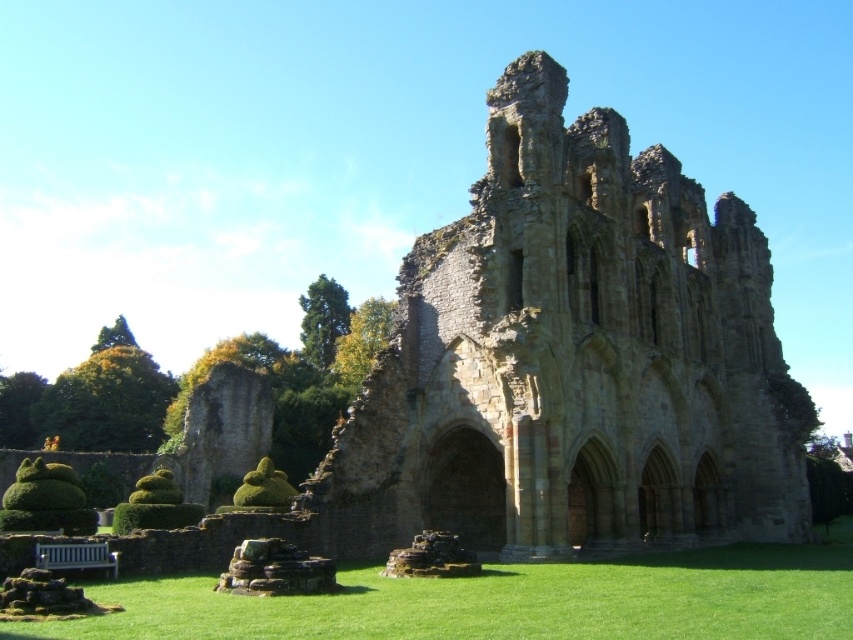
Consider the image. You are standing at the entrance of the historic stone structure and want to walk towards the point that is closer to you. Which point should you head towards, point [54,401] or point [25,483]?

You should head towards point [25,483] because it is closer to you than point [54,401], which is further away.

You are planning to set up a picnic blanket in the grassy area near the brown stone ruins at center. Considering the space available, will the green grass at lower center provide enough room for a picnic blanket that is 2 meters wide?

The brown stone ruins at center has a lesser width compared to green grass at lower center, so the green grass at lower center is wider. Since the picnic blanket is 2 meters wide, the green grass at lower center should provide sufficient space for the picnic blanket.